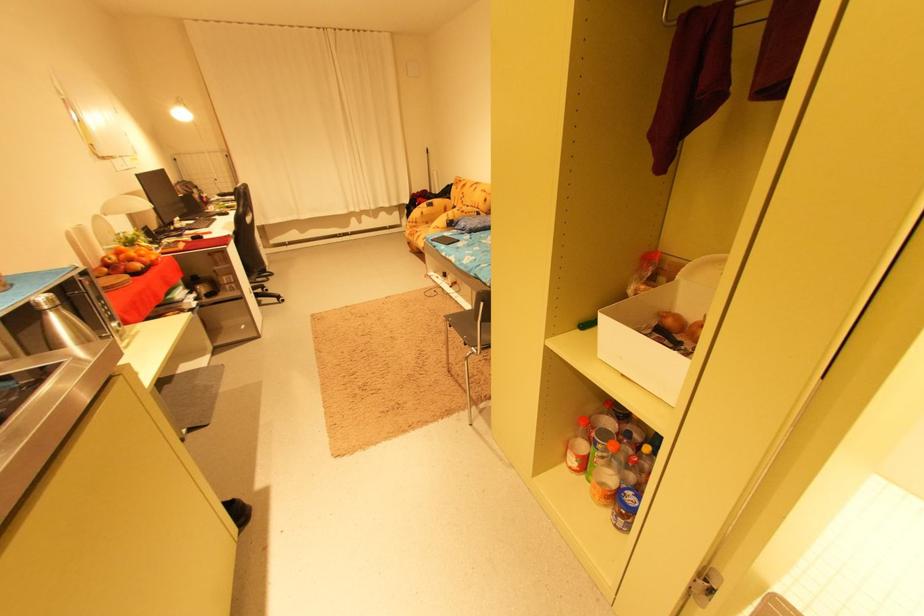
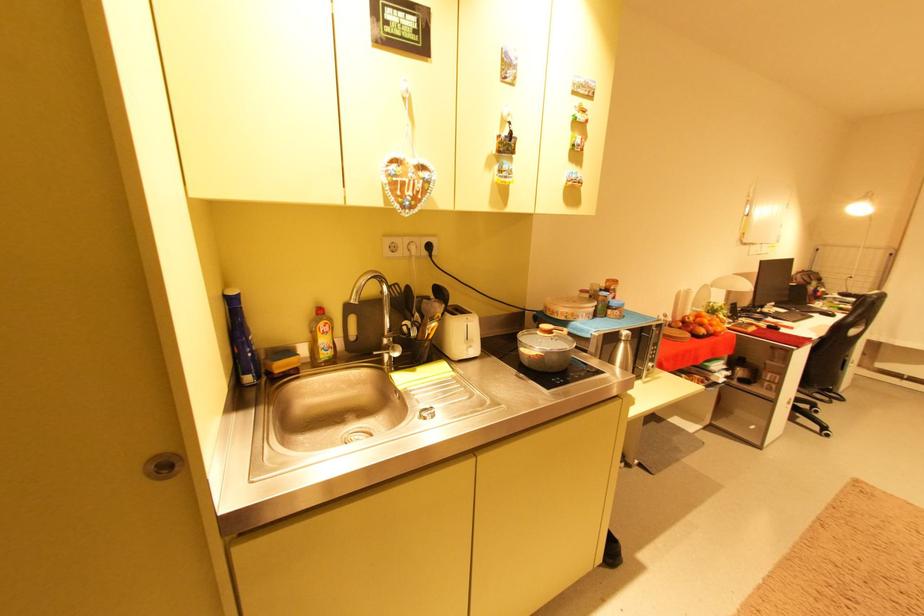
Question: Based on the continuous images, in which direction is the camera rotating? Reply with the corresponding letter.

Choices:
 (A) Left
 (B) Right
 (C) Up
 (D) Down

Answer: (A)